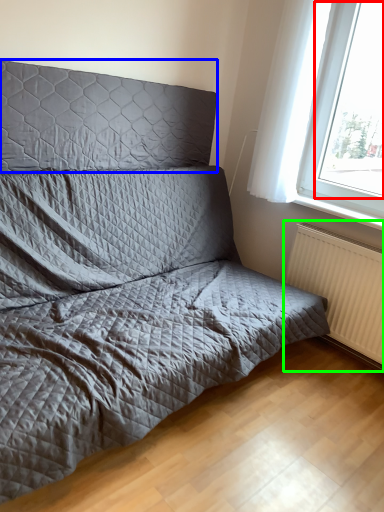
Question: Based on their relative distances, which object is farther from window screen (highlighted by a red box)? Choose from headboard (highlighted by a blue box) and radiator (highlighted by a green box).

Choices:
 (A) headboard
 (B) radiator

Answer: (A)